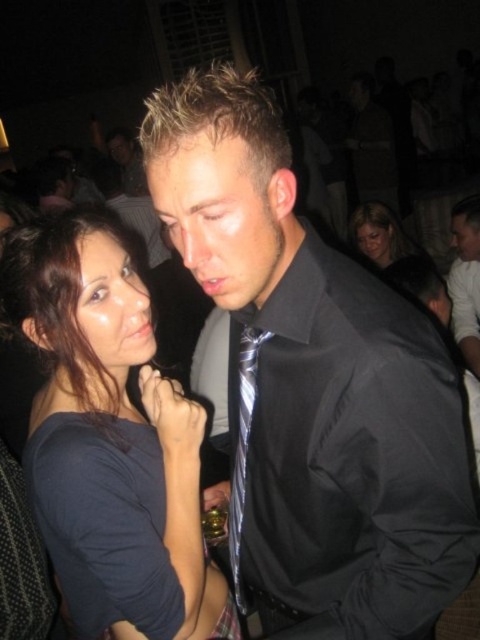
You are a photographer at a party and need to decide which shirt to focus on for a closeup. The black satin shirt at center and the dark blue fabric shirt at center are both in your frame. Which shirt should you zoom in on to capture more detail without cropping the entire shirt?

The black satin shirt at center has a larger width than the dark blue fabric shirt at center, so zooming in on the black satin shirt at center would allow you to capture more detail without cropping the entire shirt since it occupies more space in the frame.

You are a photographer at a party and want to capture a closeup shot of the silver metallic tie at center without including the dark blue fabric shirt at center in the frame. Is this possible given their sizes?

The dark blue fabric shirt at center is larger than the silver metallic tie at center, so it might block the view of the tie. It may be challenging to capture the silver metallic tie at center without including the dark blue fabric shirt at center in the frame.